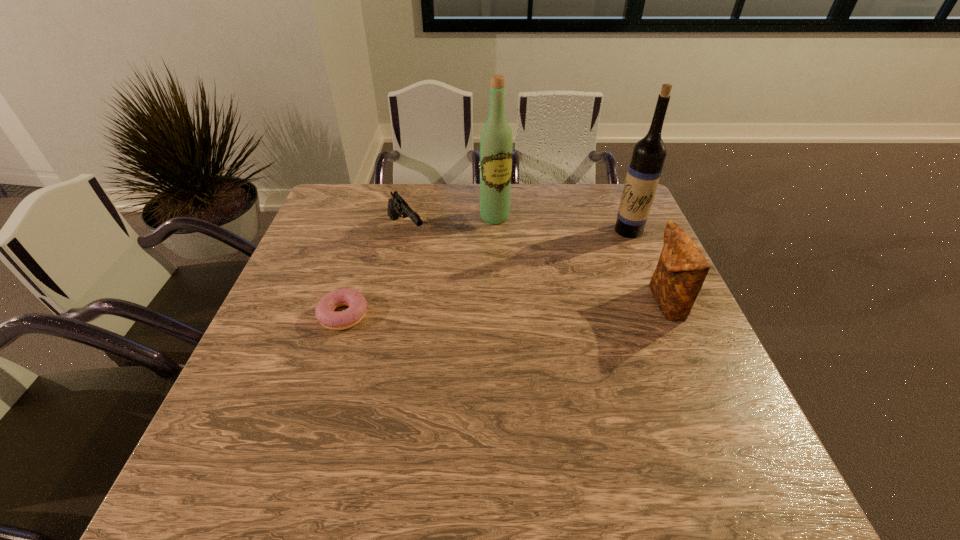
Select which object appears as the second closest to the right wine bottle. Please provide its 2D coordinates. Your answer should be formatted as a tuple, i.e. [(x, y)], where the tuple contains the x and y coordinates of a point satisfying the conditions above.

[(496, 139)]

This screenshot has width=960, height=540. In order to click on free space that satisfies the following two spatial constraints: 1. on the back side of the doughnut; 2. on the open side of the third shortest object in this screenshot , I will do `click(347, 303)`.

The image size is (960, 540). What are the coordinates of `free point that satisfies the following two spatial constraints: 1. on the back side of the shortest object; 2. on the open side of the clutch bag` in the screenshot? It's located at [347, 303].

This screenshot has height=540, width=960. I want to click on vacant space that satisfies the following two spatial constraints: 1. on the back side of the gun; 2. on the left side of the doughnut, so click(x=370, y=231).

Identify the location of vacant point that satisfies the following two spatial constraints: 1. on the back side of the third shortest object; 2. on the open side of the shortest object. (347, 303).